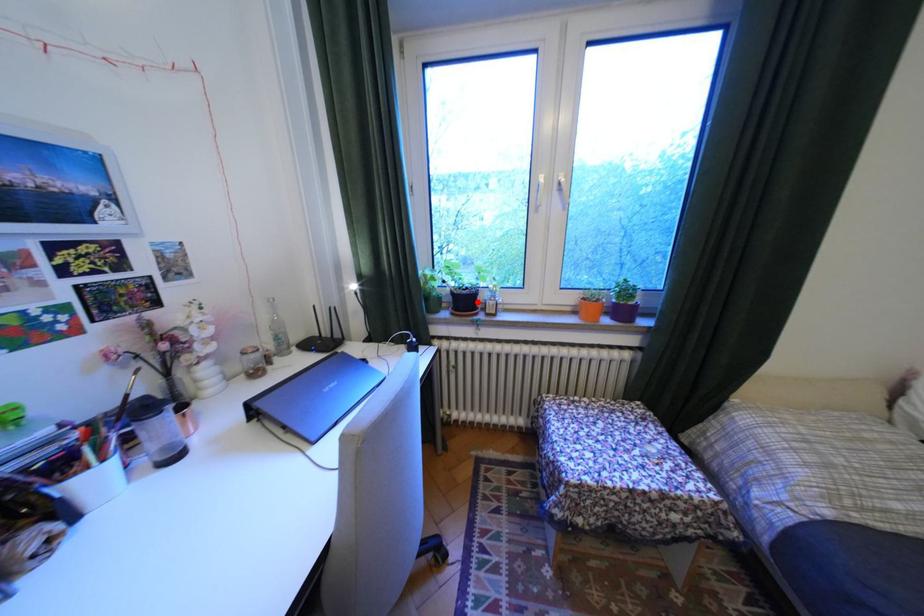
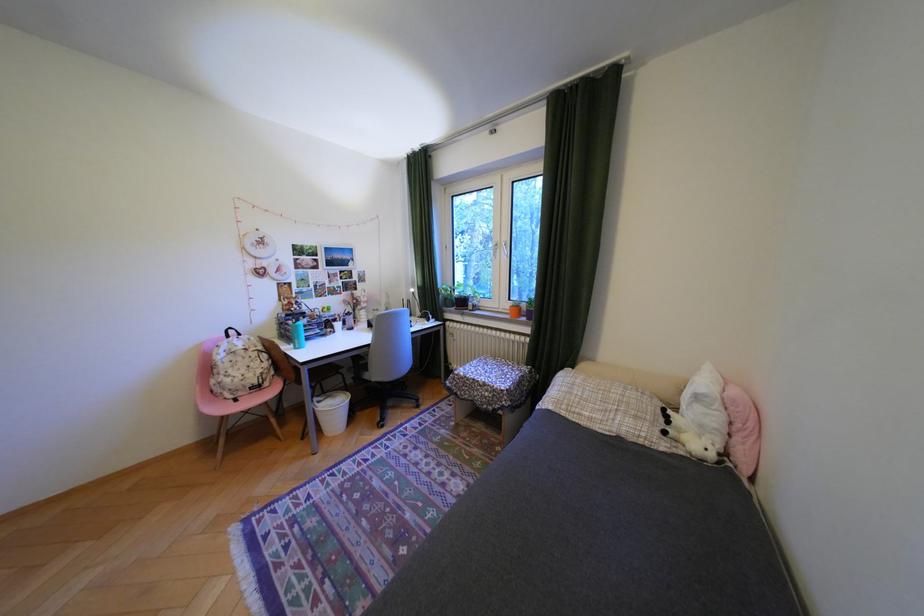
In the second image, find the point that corresponds to the highlighted location in the first image.

(475, 302)